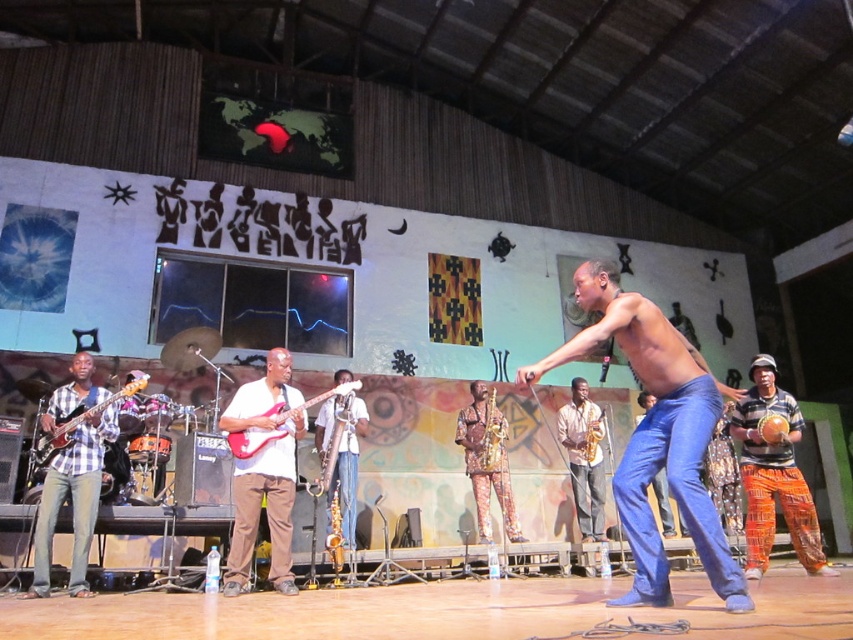
You are standing in the community hall and want to take a photo of the stage. The camera you have can only focus on objects within 3 meters. Is the point at coordinate point (546, 362) on the stage within the camera focus range?

The point at coordinate point (546, 362) is 2.88 meters away from the viewer, which is within the camera focus range of 3 meters. Therefore, the camera can focus on that point.

You are standing at the entrance of the community hall and see the stage with the band. There is a point marked at coordinates point (656, 433). What object is located at that point?

The point (656, 433) corresponds to the matte black electric guitar at center.